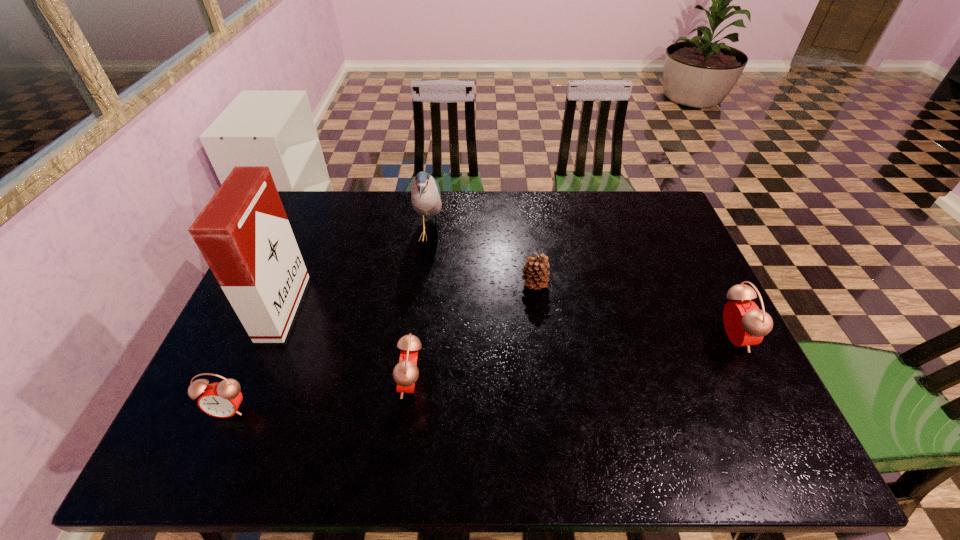
At what (x,y) coordinates should I click in order to perform the action: click on vacant region at the near edge of the desktop. Please return your answer as a coordinate pair (x, y). Image resolution: width=960 pixels, height=540 pixels. Looking at the image, I should click on (289, 399).

This screenshot has width=960, height=540. In the image, there is a desktop. In order to click on free space at the left edge in this screenshot , I will do `click(299, 246)`.

In order to click on free region at the right edge in this screenshot , I will do `click(642, 259)`.

At what (x,y) coordinates should I click in order to perform the action: click on vacant area at the far left corner. Please return your answer as a coordinate pair (x, y). Looking at the image, I should click on (294, 211).

The width and height of the screenshot is (960, 540). What are the coordinates of `vacant region at the near right corner of the desktop` in the screenshot? It's located at coord(726,406).

The width and height of the screenshot is (960, 540). What are the coordinates of `free space between the rightmost alarm clock and the leftmost alarm clock` in the screenshot? It's located at (480, 373).

Image resolution: width=960 pixels, height=540 pixels. What are the coordinates of `free point between the bird and the rightmost object` in the screenshot? It's located at (581, 286).

Image resolution: width=960 pixels, height=540 pixels. I want to click on vacant region between the third shortest object and the rightmost alarm clock, so click(x=572, y=360).

Locate an element on the screen. free space between the bird and the second tallest alarm clock is located at coordinates (420, 309).

Locate an element on the screen. The height and width of the screenshot is (540, 960). blank region between the shortest alarm clock and the farthest object is located at coordinates coord(329,321).